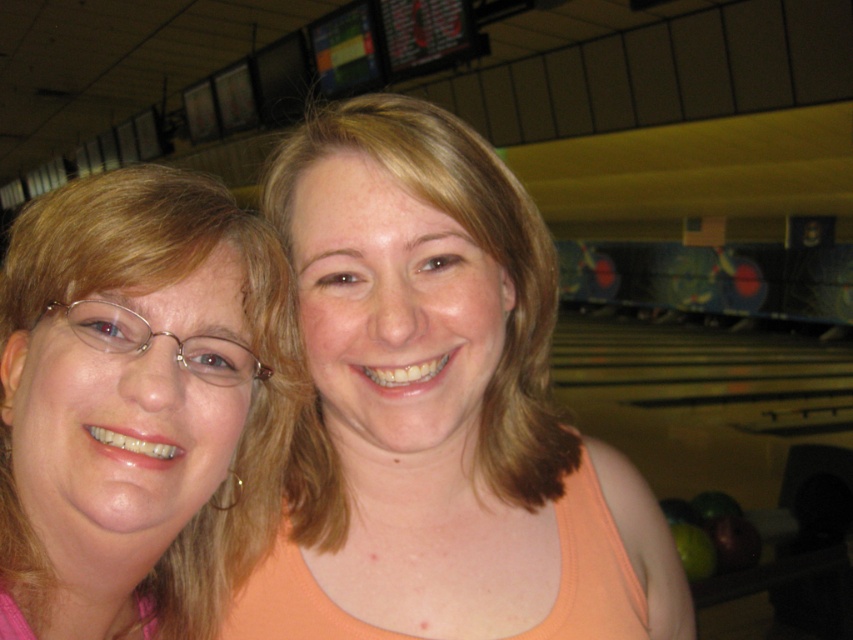
Question: Which object appears farthest from the camera in this image?

Choices:
 (A) matte peach tank top at center
 (B) pink fabric at left

Answer: (A)

Question: Which object is closer to the camera taking this photo?

Choices:
 (A) pink fabric at left
 (B) matte peach tank top at center

Answer: (A)

Question: Does matte peach tank top at center appear on the left side of pink fabric at left?

Choices:
 (A) yes
 (B) no

Answer: (B)

Question: Where is matte peach tank top at center located in relation to pink fabric at left in the image?

Choices:
 (A) left
 (B) right

Answer: (B)

Question: Is matte peach tank top at center smaller than pink fabric at left?

Choices:
 (A) yes
 (B) no

Answer: (B)